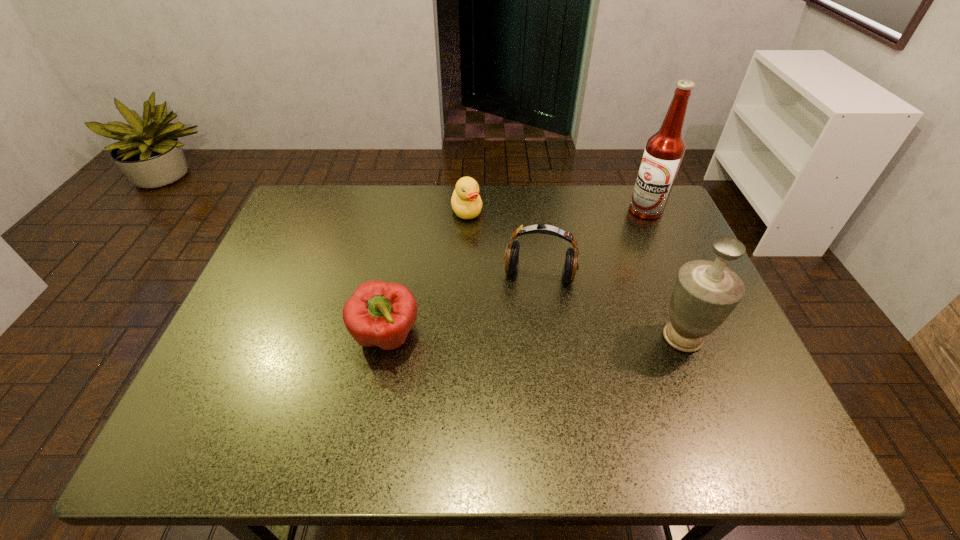
Where is `vacant spot on the desktop that is between the leftmost object and the urn and is positioned on the label side of the tallest object`? vacant spot on the desktop that is between the leftmost object and the urn and is positioned on the label side of the tallest object is located at coordinates (573, 337).

Find the location of a particular element. This screenshot has height=540, width=960. free spot on the desktop that is between the leftmost object and the fourth shortest object and is positioned at the beak of the shortest object is located at coordinates (499, 337).

Locate an element on the screen. vacant space on the desktop that is between the leftmost object and the urn and is positioned on the ear cups of the headset is located at coordinates (530, 337).